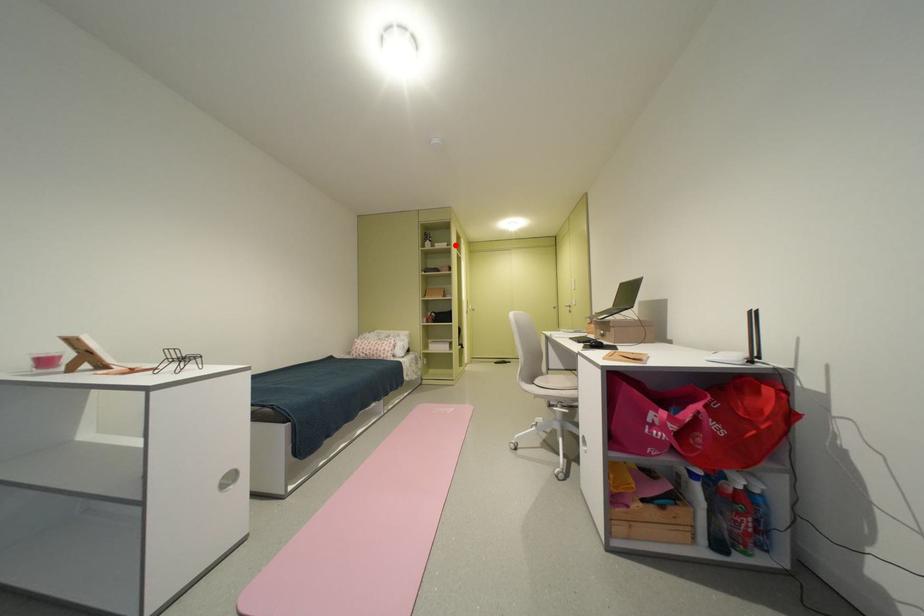
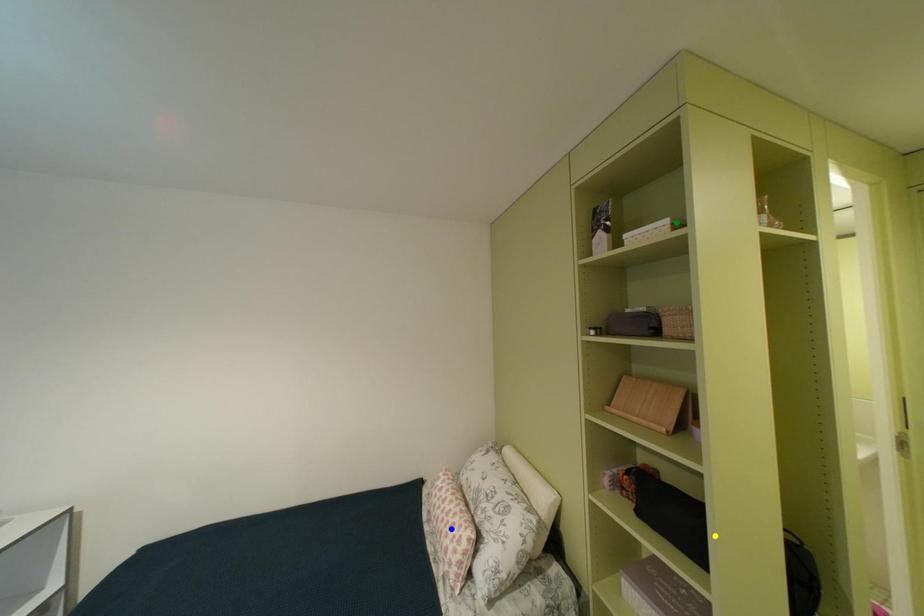
Question: I am providing you with two images of the same scene from different viewpoints. A red point is marked on the first image. You are given multiple points on the second image. Which spot in image 2 lines up with the point in image 1?

Choices:
 (A) yellow point
 (B) green point
 (C) blue point

Answer: (B)